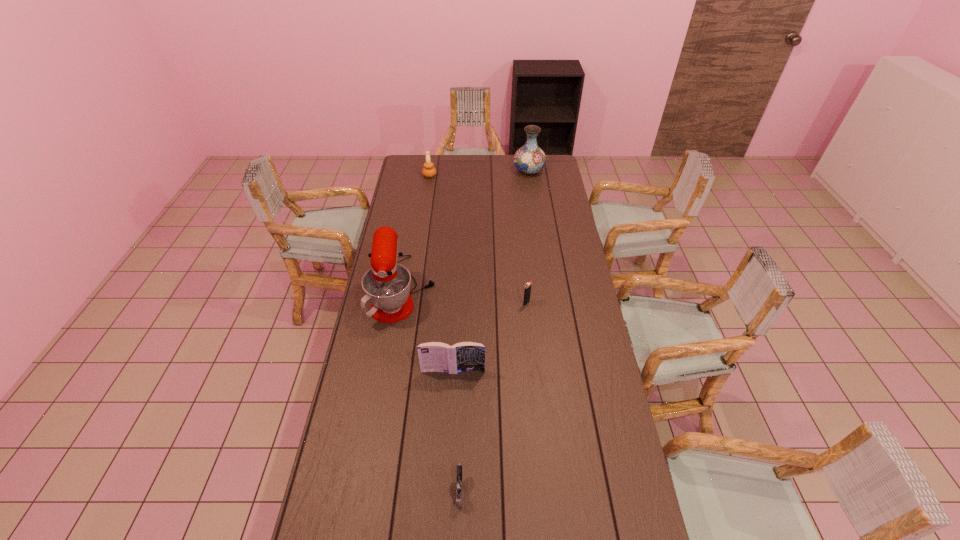
Where is `mixer`? mixer is located at coordinates (387, 285).

Identify the location of vase. The height and width of the screenshot is (540, 960). (529, 159).

Where is `candle_holder`? The height and width of the screenshot is (540, 960). candle_holder is located at coordinates [429, 171].

This screenshot has width=960, height=540. Find the location of `book`. book is located at coordinates (434, 356).

This screenshot has height=540, width=960. What are the coordinates of `the right igniter` in the screenshot? It's located at (527, 292).

This screenshot has height=540, width=960. Identify the location of the nearer igniter. (458, 487).

You are a GUI agent. You are given a task and a screenshot of the screen. Output one action in this format:
    pyautogui.click(x=<x>, y=<y>)
    Task: Click on the left igniter
    
    Given the screenshot: What is the action you would take?
    pyautogui.click(x=458, y=487)

At what (x,y) coordinates should I click in order to perform the action: click on free point located on the bowl side of the mixer. Please return your answer as a coordinate pair (x, y). The image size is (960, 540). Looking at the image, I should click on (493, 289).

Where is `free space located on the front of the vase`? The width and height of the screenshot is (960, 540). free space located on the front of the vase is located at coordinates (532, 195).

The height and width of the screenshot is (540, 960). In order to click on vacant space located on the front of the candle_holder in this screenshot , I will do `click(424, 212)`.